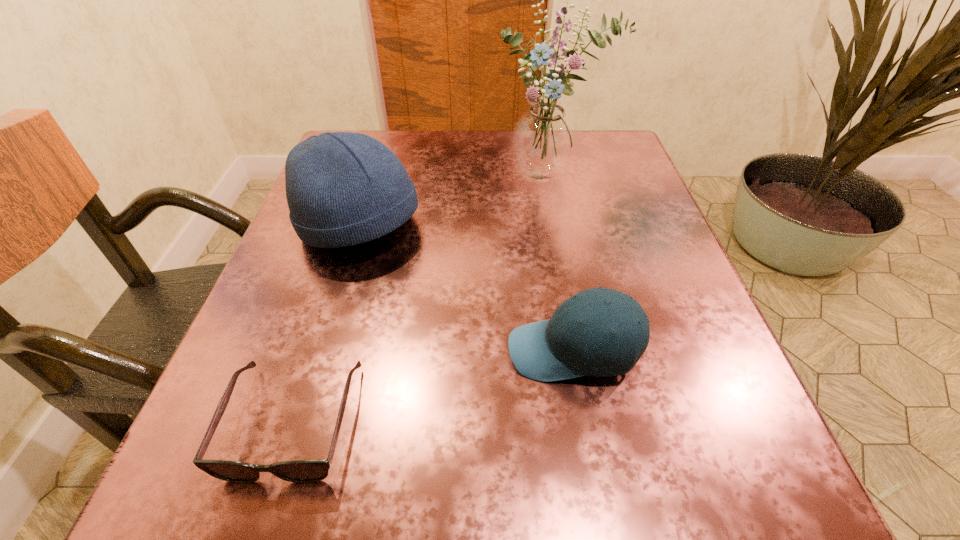
You are a GUI agent. You are given a task and a screenshot of the screen. Output one action in this format:
    pyautogui.click(x=<x>, y=<y>)
    Task: Click on the vacant space at the far right corner of the desktop
    
    Given the screenshot: What is the action you would take?
    592,146

Locate an element on the screen. free space between the baseball cap and the third shortest object is located at coordinates (467, 288).

At what (x,y) coordinates should I click in order to perform the action: click on vacant area between the second shortest object and the shortest object. Please return your answer as a coordinate pair (x, y). The height and width of the screenshot is (540, 960). Looking at the image, I should click on (433, 386).

At what (x,y) coordinates should I click in order to perform the action: click on empty space that is in between the tallest object and the shortest object. Please return your answer as a coordinate pair (x, y). Looking at the image, I should click on (421, 299).

This screenshot has height=540, width=960. I want to click on blank region between the baseball cap and the tallest object, so click(562, 264).

Identify the location of free space that is in between the sunglasses and the baseball cap. (433, 386).

Locate an element on the screen. This screenshot has height=540, width=960. free space between the shortest object and the second tallest object is located at coordinates (326, 323).

Identify the location of vacant area that lies between the tallest object and the sunglasses. Image resolution: width=960 pixels, height=540 pixels. (421, 299).

You are a GUI agent. You are given a task and a screenshot of the screen. Output one action in this format:
    pyautogui.click(x=<x>, y=<y>)
    Task: Click on the free space that is in between the third tallest object and the bouquet
    
    Given the screenshot: What is the action you would take?
    pyautogui.click(x=562, y=264)

Locate an element on the screen. Image resolution: width=960 pixels, height=540 pixels. free point between the sunglasses and the second shortest object is located at coordinates (433, 386).